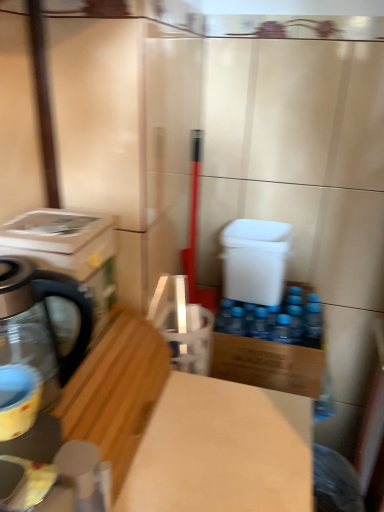
Question: From the image's perspective, relative to white plastic water cooler at center, is white glossy washing machine at left above or below?

Choices:
 (A) below
 (B) above

Answer: (B)

Question: Is point (1, 230) positioned closer to the camera than point (284, 238)?

Choices:
 (A) farther
 (B) closer

Answer: (B)

Question: Which object is the closest to the white plastic water cooler at center?

Choices:
 (A) light brown wood at center
 (B) white glossy washing machine at left
 (C) matte black kettle at left
 (D) wooden cutting board at lower left
 (E) matte yellow cup at left

Answer: (A)

Question: Estimate the real-world distances between objects in this image. Which object is closer to the matte yellow cup at left?

Choices:
 (A) wooden cutting board at lower left
 (B) white glossy washing machine at left
 (C) matte black kettle at left
 (D) white plastic water cooler at center
 (E) light brown wood at center

Answer: (C)